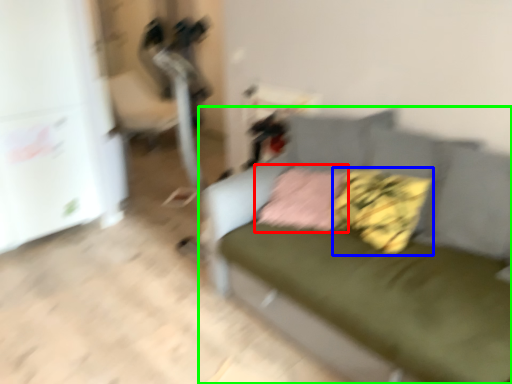
Question: Considering the real-world distances, which object is farthest from pillow (highlighted by a red box)? pillow (highlighted by a blue box) or studio couch (highlighted by a green box)?

Choices:
 (A) pillow
 (B) studio couch

Answer: (B)